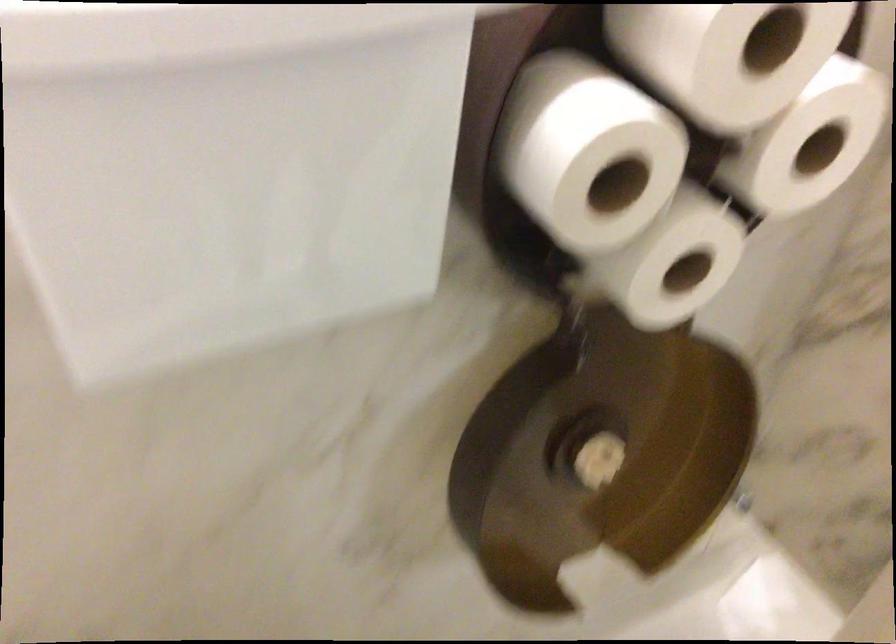
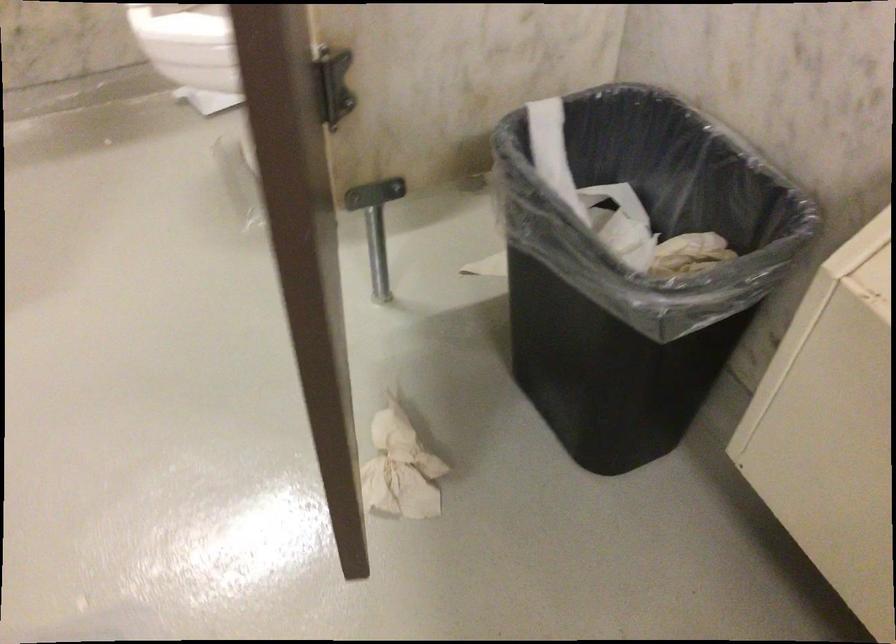
Question: Which direction would the cameraman need to move to produce the second image? Reply with the corresponding letter.

Choices:
 (A) Left
 (B) Right
 (C) Forward
 (D) Backward

Answer: (B)